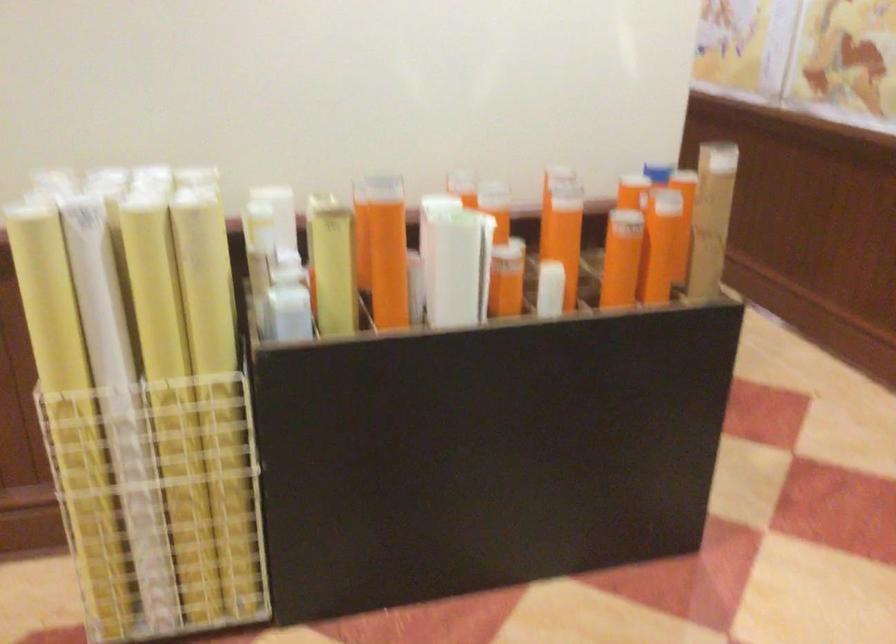
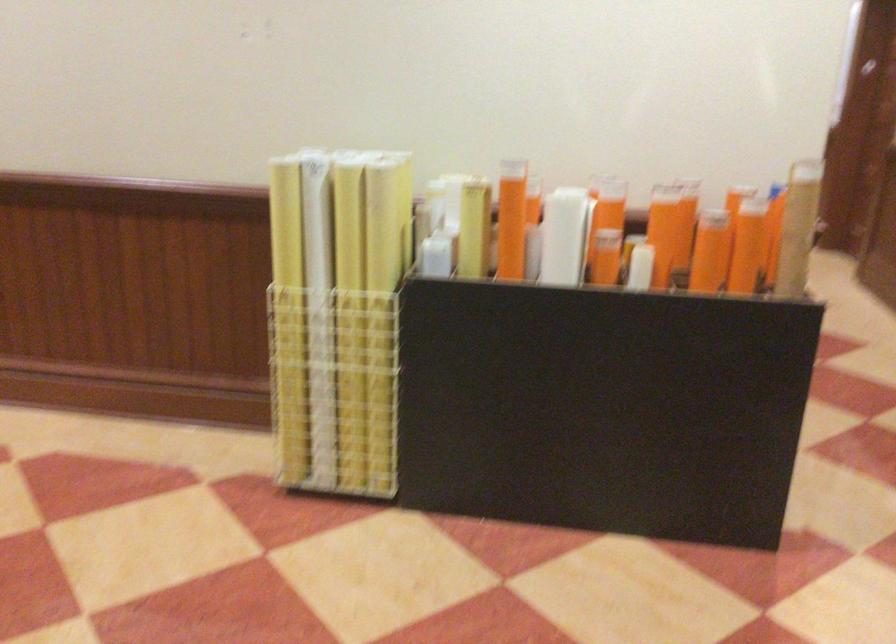
The point at (222, 401) is marked in the first image. Where is the corresponding point in the second image?

(382, 314)